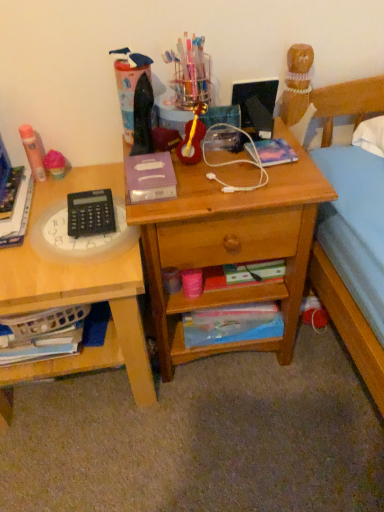
Image resolution: width=384 pixels, height=512 pixels. Identify the location of vacant region in front of multicolored fabric book at center, the 1th paperback book positioned from the top. (273, 180).